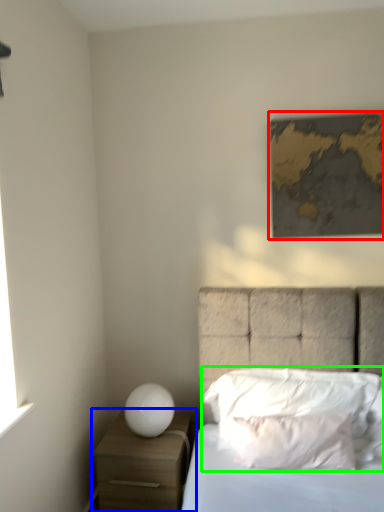
Question: Which is farther away from picture frame (highlighted by a red box)? nightstand (highlighted by a blue box) or pillow (highlighted by a green box)?

Choices:
 (A) nightstand
 (B) pillow

Answer: (A)